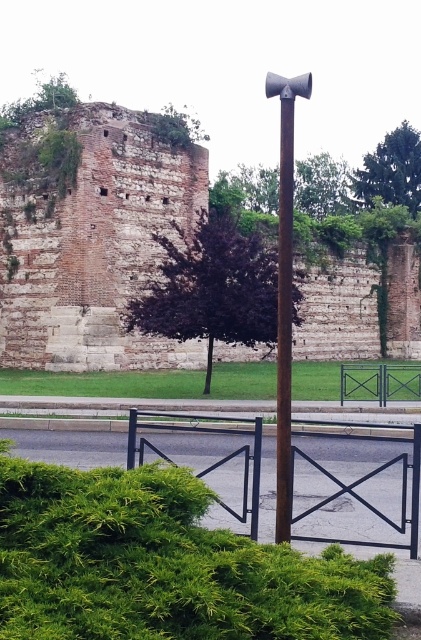
Question: Among these points, which one is nearest to the camera?

Choices:
 (A) (285, 324)
 (B) (69, 618)
 (C) (250, 300)

Answer: (B)

Question: In this image, where is brick wall at left located relative to rusty metal pole at center?

Choices:
 (A) right
 (B) left

Answer: (B)

Question: Where is brick wall at left located in relation to green leafy bush at upper right in the image?

Choices:
 (A) below
 (B) above

Answer: (A)

Question: Estimate the real-world distances between objects in this image. Which object is closer to the green leafy bush at upper right?

Choices:
 (A) green leafy hedge at lower left
 (B) purple leafy hedge at center
 (C) polished metal pole at center
 (D) black metal gate at center

Answer: (C)

Question: Considering the relative positions of green leafy hedge at lower left and green leafy bush at upper right in the image provided, where is green leafy hedge at lower left located with respect to green leafy bush at upper right?

Choices:
 (A) left
 (B) right

Answer: (A)

Question: Which object is the closest to the purple leafy hedge at center?

Choices:
 (A) green metal gate at center
 (B) brick wall at left
 (C) polished metal pole at center
 (D) green leafy bush at upper right

Answer: (B)